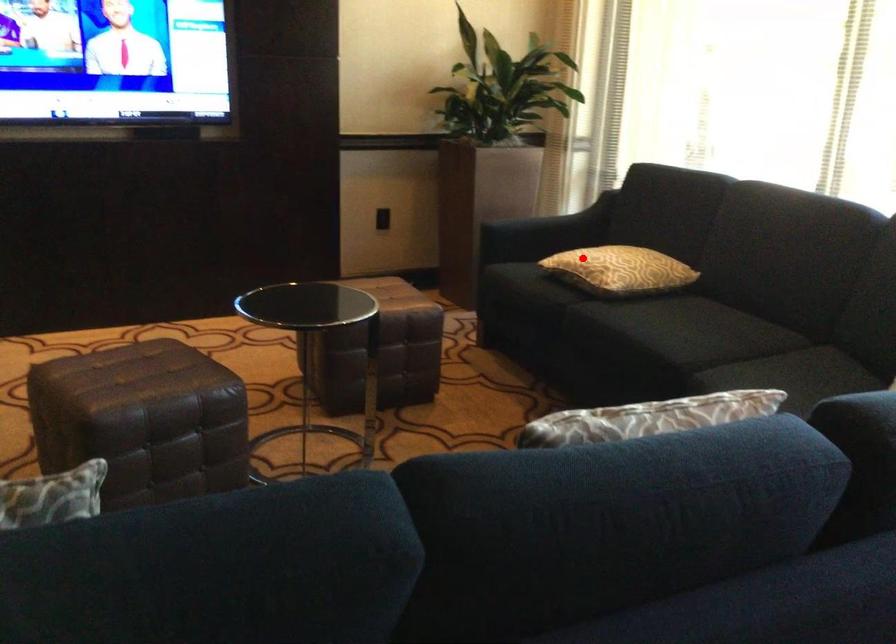
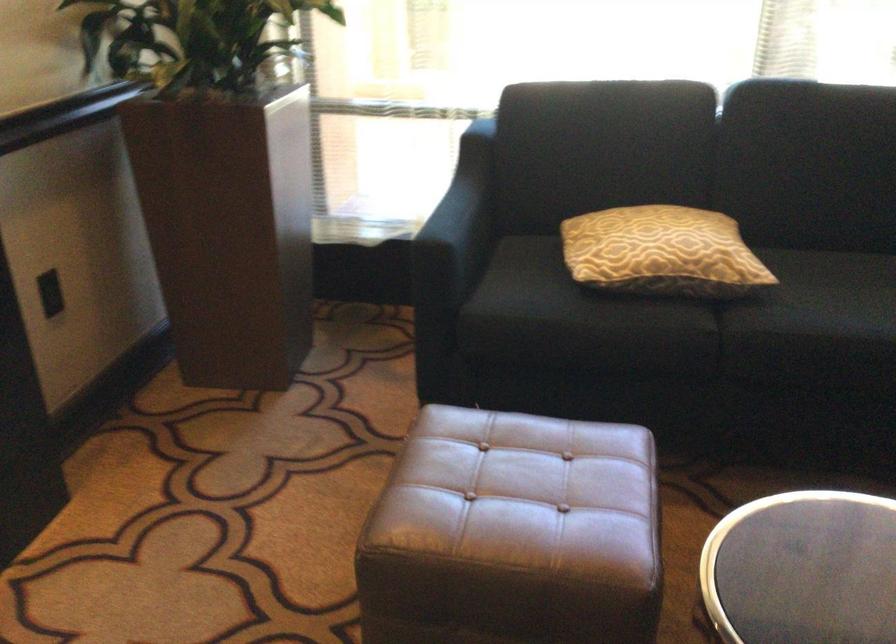
Where in the second image is the point corresponding to the highlighted location from the first image?

(661, 252)